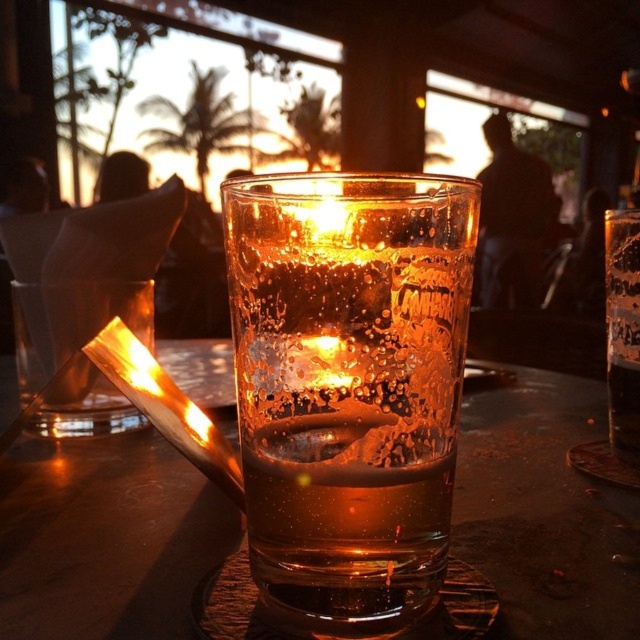
Can you confirm if translucent glass at center is positioned to the left of transparent glass at center?

In fact, translucent glass at center is to the right of transparent glass at center.

Measure the distance between point (385, 556) and camera.

Point (385, 556) is 15.44 centimeters away from camera.

Is point (428, 468) positioned before point (157, 340)?

Yes, it is.

Find the location of `translucent glass at center`. translucent glass at center is located at coordinates (348, 387).

Which is above, translucent glass at center or translucent glass beer at center?

translucent glass beer at center is higher up.

This screenshot has height=640, width=640. I want to click on translucent glass at center, so click(348, 387).

Does transparent glass at center appear over translucent glass beer at center?

No.

Is transparent glass at center in front of translucent glass beer at center?

Yes.

Which is in front, point (108, 625) or point (637, 452)?

Positioned in front is point (108, 625).

The width and height of the screenshot is (640, 640). In order to click on transparent glass at center in this screenshot , I will do `click(106, 538)`.